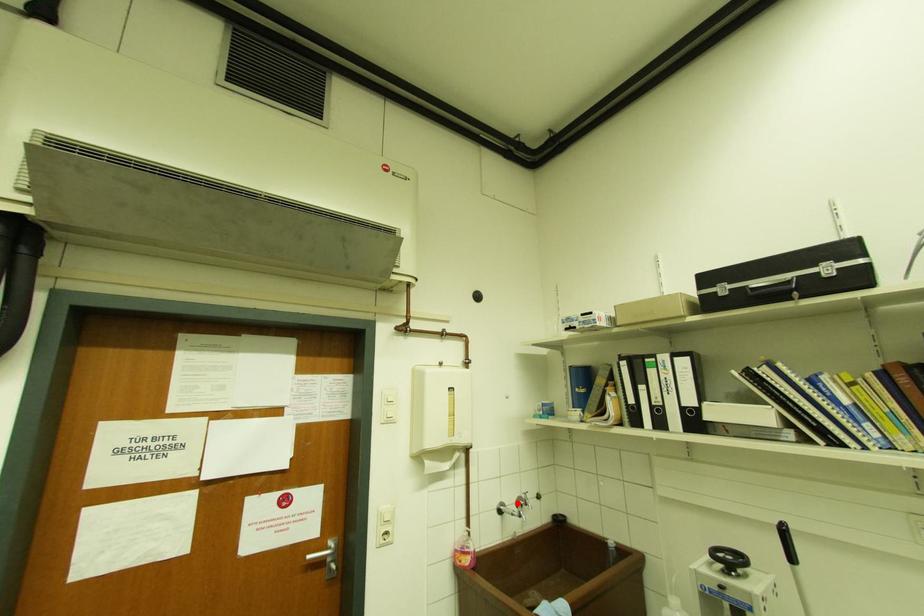
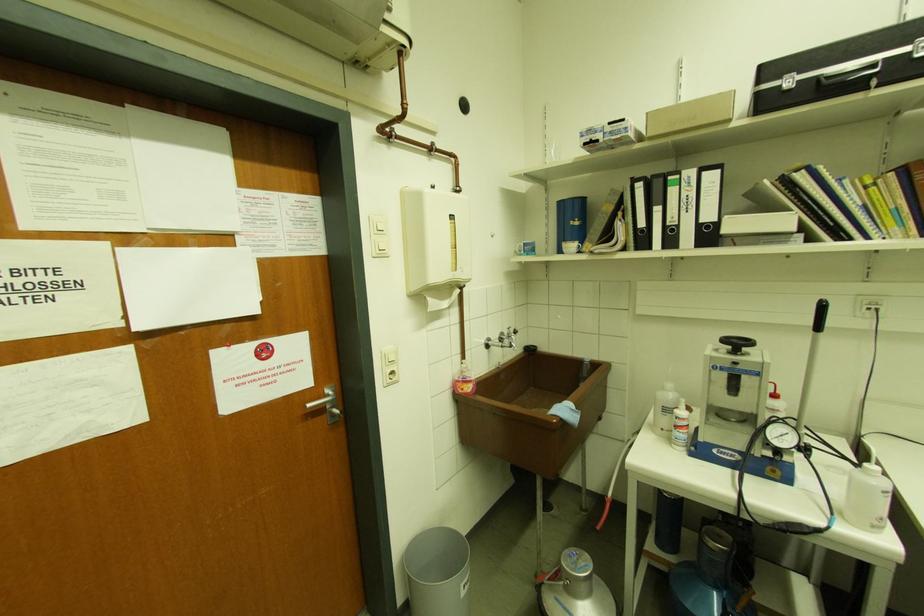
Locate, in the second image, the point that corresponds to the highlighted location in the first image.

(501, 339)